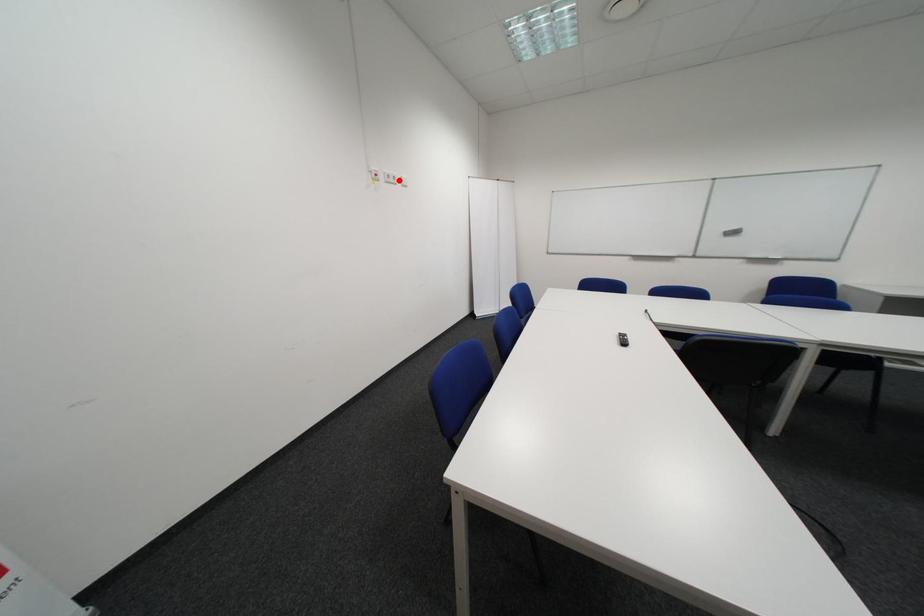
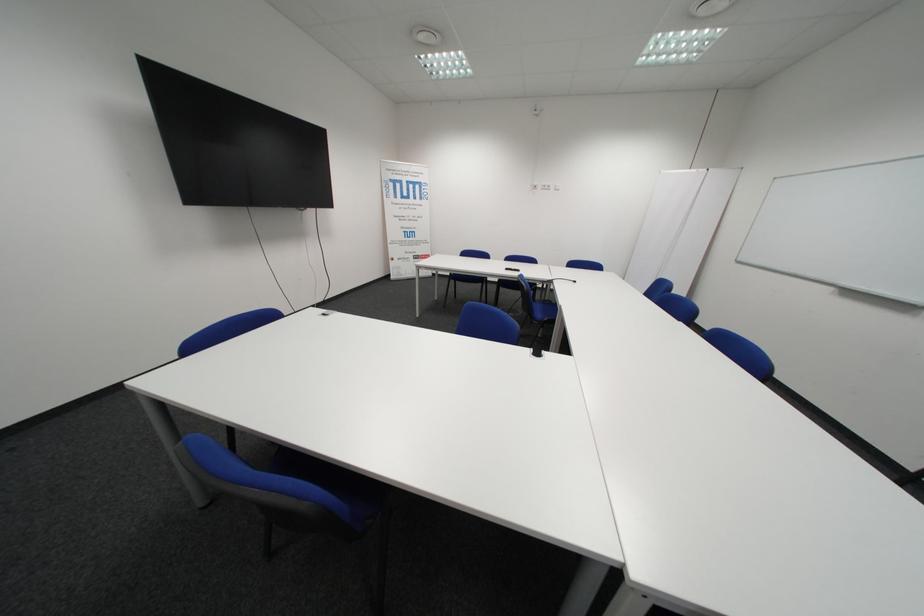
Locate, in the second image, the point that corresponds to the highlighted location in the first image.

(554, 188)